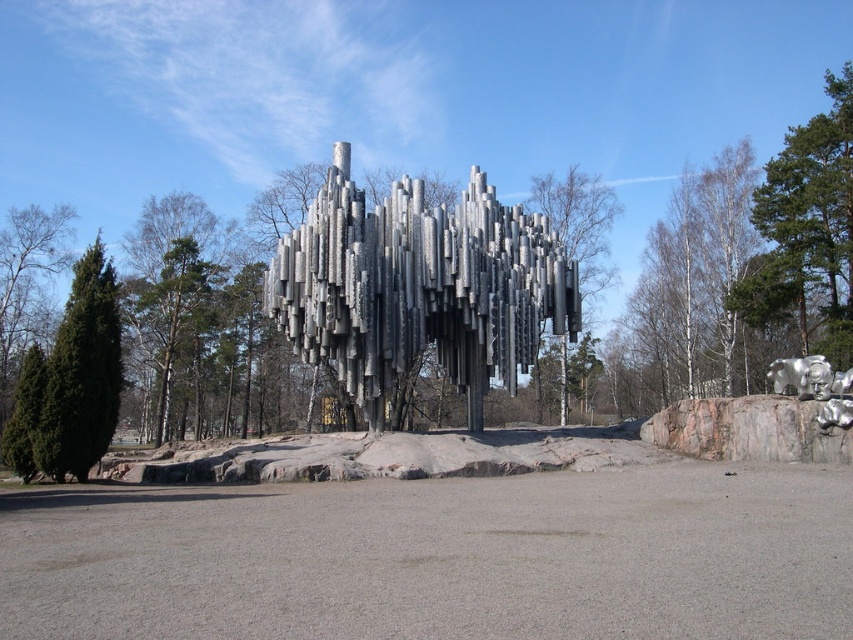
Question: Is the position of polished metal sculpture at center more distant than that of green matte tree at left?

Choices:
 (A) no
 (B) yes

Answer: (B)

Question: Which point is closer to the camera?

Choices:
 (A) (94, 413)
 (B) (782, 384)
 (C) (824, 122)
 (D) (570, 228)

Answer: (A)

Question: Which object is positioned closest to the polished metal sculpture at center?

Choices:
 (A) white bark tree at center
 (B) rocky gray rock at right

Answer: (B)

Question: Among these objects, which one is farthest from the camera?

Choices:
 (A) polished metal sculpture at center
 (B) rocky gray rock at right
 (C) silver metallic bear at center

Answer: (A)

Question: Does polished metal sculpture at center have a smaller size compared to rocky gray rock at right?

Choices:
 (A) yes
 (B) no

Answer: (B)

Question: Where is white bark tree at center located in relation to silver metallic bear at center in the image?

Choices:
 (A) right
 (B) left

Answer: (B)